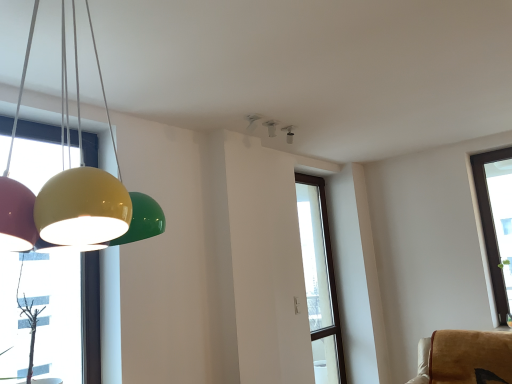
Question: In the image, is transparent glass window at center positioned in front of or behind white glossy light fixture at upper center, marked as the second lamp in a left-to-right arrangement?

Choices:
 (A) behind
 (B) front

Answer: (A)

Question: From the image's perspective, relative to white glossy light fixture at upper center, positioned as the second lamp in bottom-to-top order, is transparent glass window at center above or below?

Choices:
 (A) below
 (B) above

Answer: (A)

Question: Considering the real-world distances, which object is closest to the white glossy light fixture at upper center, marked as the first lamp in a right-to-left arrangement?

Choices:
 (A) transparent glass window at center
 (B) glossy plastic lampshade at left, the first lamp viewed from the front

Answer: (A)

Question: Estimate the real-world distances between objects in this image. Which object is closer to the glossy plastic lampshade at left, the 2th lamp viewed from the back?

Choices:
 (A) transparent glass window at center
 (B) white glossy light fixture at upper center, marked as the first lamp in a right-to-left arrangement

Answer: (B)